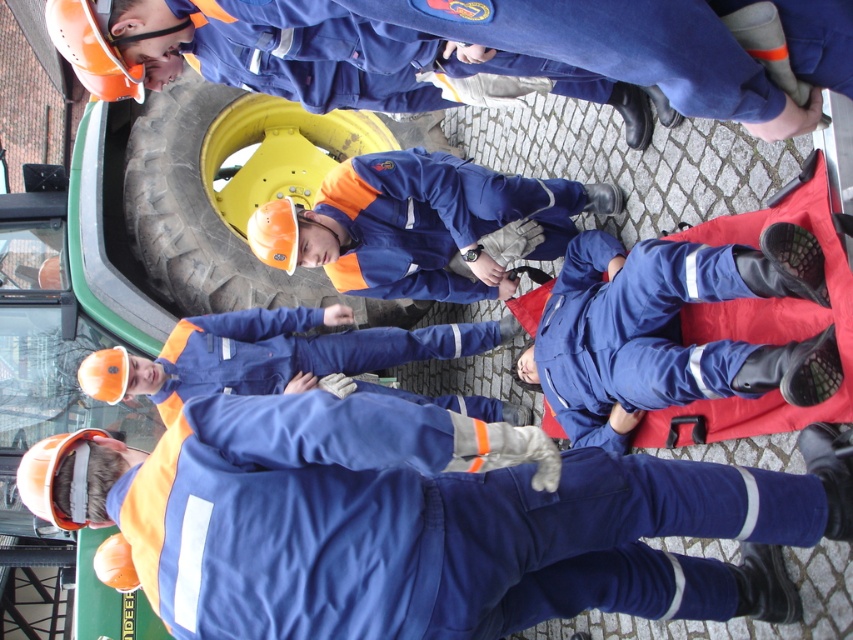
You are a safety inspector assessing the scene. You notice the matte blue jumpsuit at center and the yellow rubber tire at center. Based on their sizes, which one would you prioritize checking for proper safety compliance?

The matte blue jumpsuit at center is smaller than the yellow rubber tire at center, so the inspector should prioritize checking the matte blue jumpsuit at center for proper safety compliance since it is closer to the workers and more likely to affect their immediate safety.

You are a safety inspector assessing the scene. You notice the matte blue jumpsuit at center and the yellow rubber tire at center. Which object is closer to the ground?

The matte blue jumpsuit at center is shorter than the yellow rubber tire at center, so the matte blue jumpsuit at center is closer to the ground.